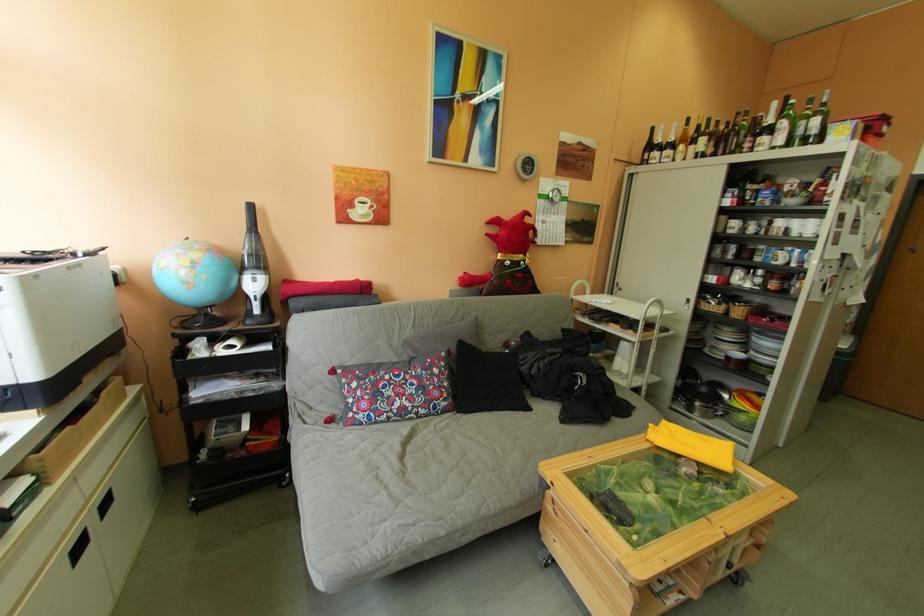
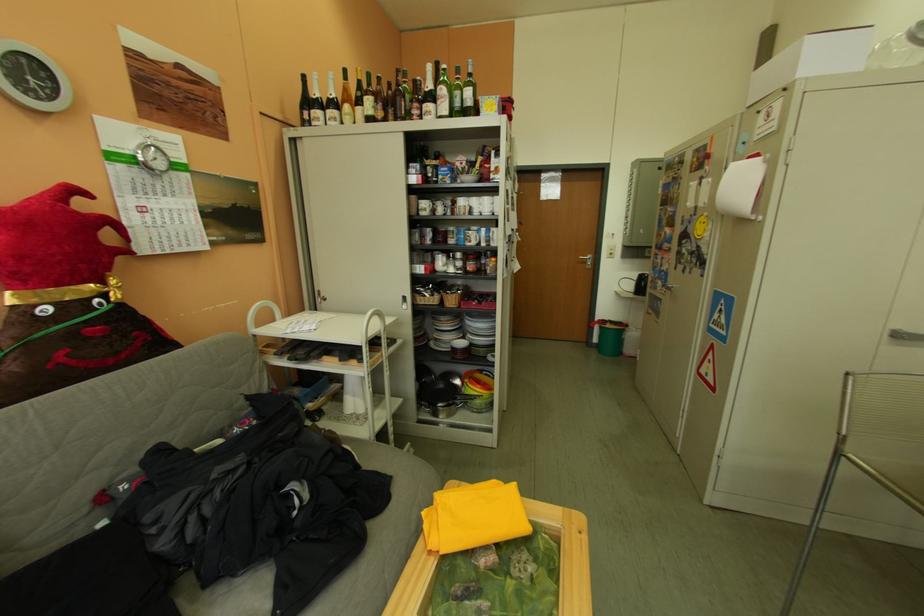
Locate, in the second image, the point that corresponds to point (788, 137) in the first image.

(452, 105)